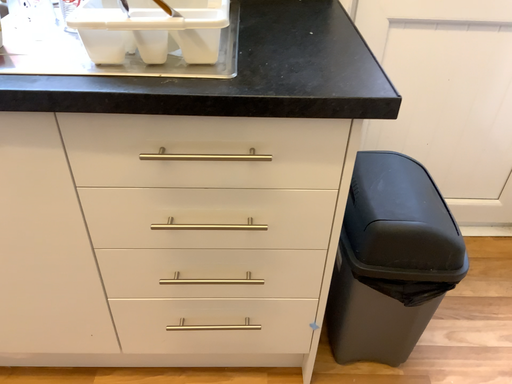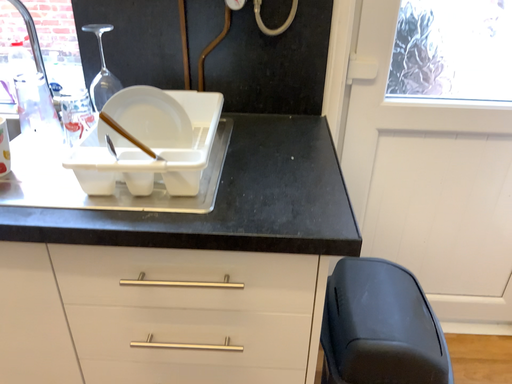
Question: How did the camera likely rotate when shooting the video?

Choices:
 (A) rotated upward
 (B) rotated downward

Answer: (A)